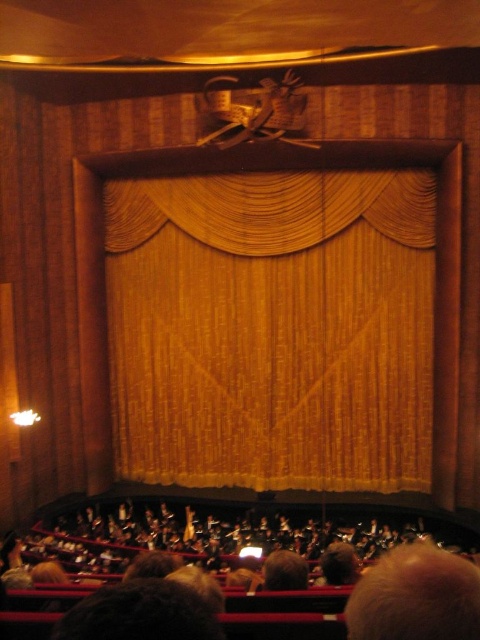
Question: Which object is closer to the camera taking this photo?

Choices:
 (A) dark brown hair at lower center
 (B) gold textured curtain at center

Answer: (A)

Question: Is gold textured curtain at center above dark brown hair at lower center?

Choices:
 (A) yes
 (B) no

Answer: (A)

Question: Is gold textured curtain at center closer to camera compared to dark brown hair at lower center?

Choices:
 (A) yes
 (B) no

Answer: (B)

Question: Does gold textured curtain at center have a smaller size compared to dark brown hair at lower center?

Choices:
 (A) yes
 (B) no

Answer: (A)